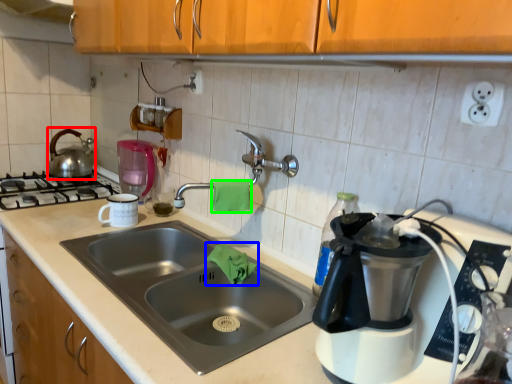
Question: Estimate the real-world distances between objects in this image. Which object is farther from tea pot (highlighted by a red box), material (highlighted by a blue box) or material (highlighted by a green box)?

Choices:
 (A) material
 (B) material

Answer: (B)